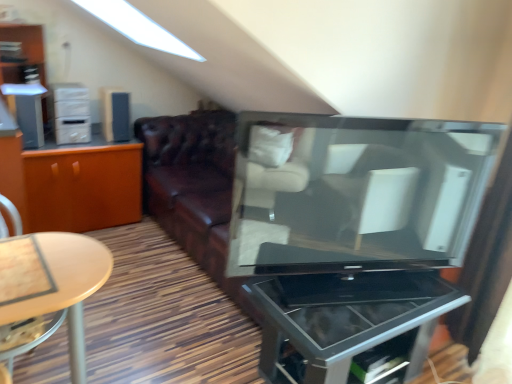
Identify the location of vacant area that is situated to the right of satin silver speaker at left, positioned as the 2th appliance in back-to-front order. (53, 148).